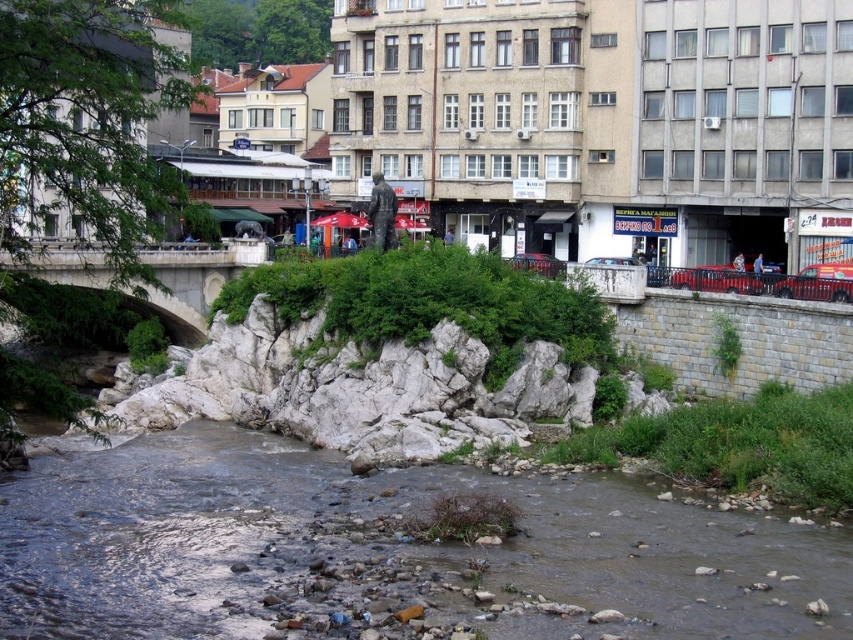
You are a pedestrian trying to cross the river using the white stone bridge at left. However, you notice the brown rocky riverbed at lower center. Is the bridge accessible from the riverbed?

The brown rocky riverbed at lower center is in front of the white stone bridge at left, meaning the bridge is behind the riverbed. Since the riverbed is in front, you would need to go around or over the riverbed to reach the bridge.

You are a hiker who wants to cross the river using the brown rocky riverbed at lower center and the white stone bridge at left. Which path would require climbing higher?

The white stone bridge at left requires climbing higher than the brown rocky riverbed at lower center because the brown rocky riverbed at lower center has a lesser height compared to white stone bridge at left.

From the picture: You are a pedestrian trying to cross the river using the white stone bridge at left. However, you notice the brown rocky riverbed at lower center nearby. Which direction should you go relative to the bridge to reach the riverbed?

The brown rocky riverbed at lower center is positioned on the right side of white stone bridge at left, so you should go to the right of the bridge to reach the riverbed.